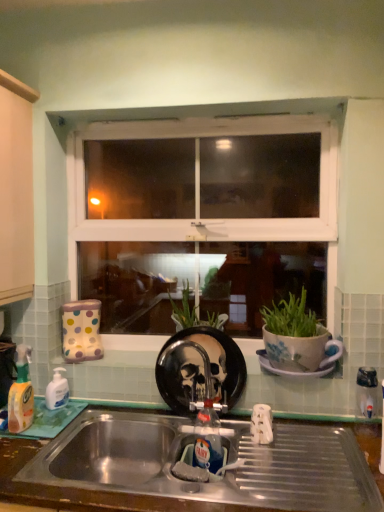
This screenshot has width=384, height=512. Identify the location of vacant space situated above stainless steel sink at lower center (from a real-world perspective). (255, 449).